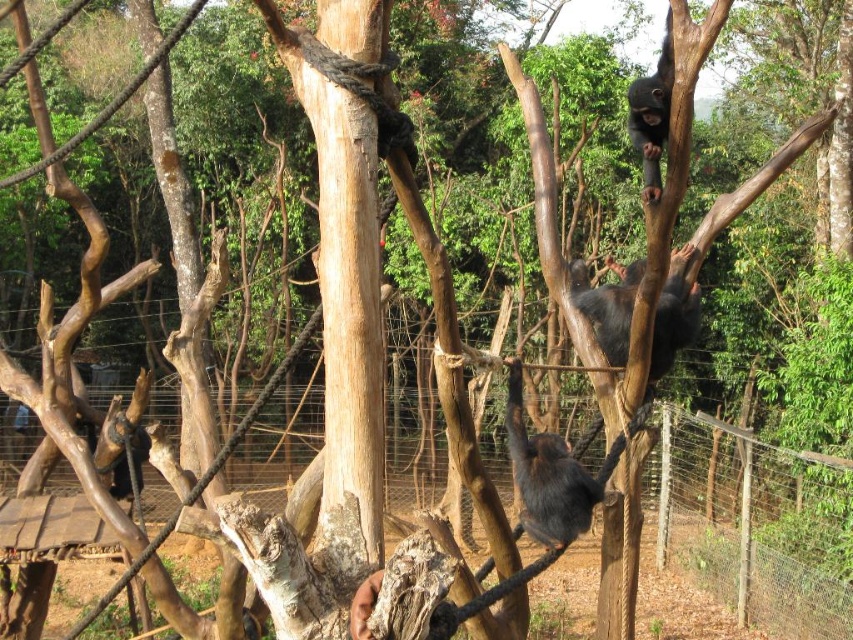
You are a zookeeper observing the chimpanzee enclosure. You notice two points marked in the image. Which of the two points, point [628,570] or point [555,445], is closer to your viewpoint as you look at the enclosure?

Point [628,570] is closer to the camera than point [555,445].

You are a zookeeper who needs to place a new camera to monitor the chimpanzees. The camera must be placed exactly 3 meters away from the wire mesh fence at center. Is the current placement of the camera meeting this requirement?

The wire mesh fence at center and camera are 2.87 meters apart, so the current placement of the camera is not meeting the requirement of being exactly 3 meters away from the wire mesh fence at center.

You are a zookeeper standing at the entrance of the chimpanzee enclosure. You need to reach a specific point marked at coordinates point (88, 461) to place a feeding station. The safety protocol states that you must stay within 7 meters of the entrance for safety. Can you safely reach that point?

The distance of point (88, 461) from camera is 6.80 meters, so yes, you can safely reach that point as it is within the 7 meters safety limit.